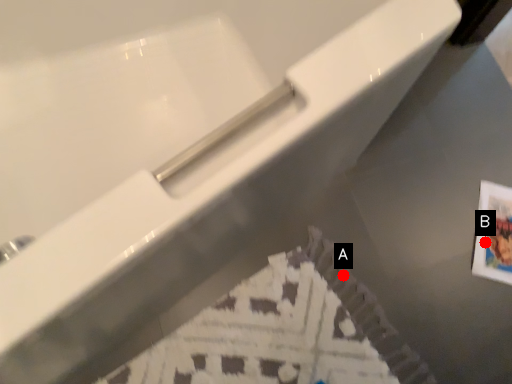
Question: Two points are circled on the image, labeled by A and B beside each circle. Among these points, which one is farthest from the camera?

Choices:
 (A) A is further
 (B) B is further

Answer: (B)